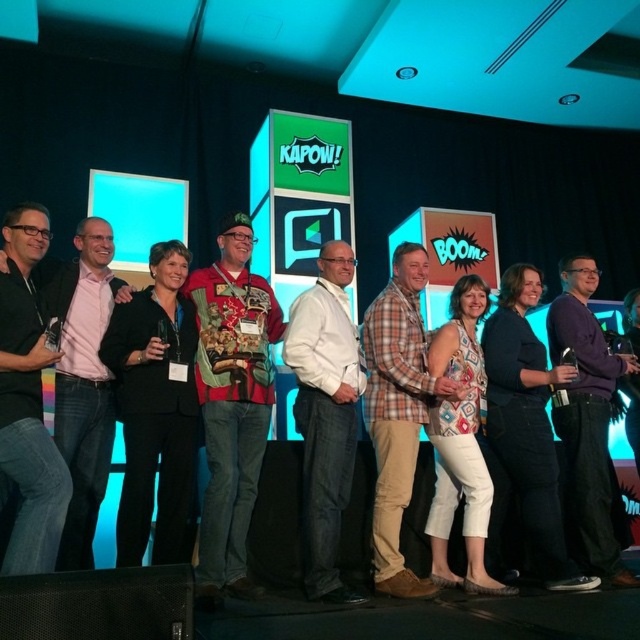
Between point (333, 522) and point (51, 316), which one is positioned in front?

Point (51, 316) is in front.

Is white matte shirt at center closer to camera compared to black matte suit at left?

No.

Is point (308, 458) positioned before point (67, 531)?

No, (308, 458) is further to viewer.

Locate an element on the screen. This screenshot has width=640, height=640. white matte shirt at center is located at coordinates (324, 413).

Is white matte shirt at center bigger than plaid cotton shirt at center?

Incorrect, white matte shirt at center is not larger than plaid cotton shirt at center.

Is point (307, 349) closer to camera compared to point (392, 573)?

That is False.

Identify the location of white matte shirt at center. This screenshot has height=640, width=640. (324, 413).

Is white matte shirt at center above purple cotton shirt at center?

Indeed, white matte shirt at center is positioned over purple cotton shirt at center.

Does white matte shirt at center have a greater width compared to purple cotton shirt at center?

Incorrect, white matte shirt at center's width does not surpass purple cotton shirt at center's.

What do you see at coordinates (324, 413) in the screenshot?
I see `white matte shirt at center` at bounding box center [324, 413].

This screenshot has width=640, height=640. I want to click on white matte shirt at center, so pyautogui.click(x=324, y=413).